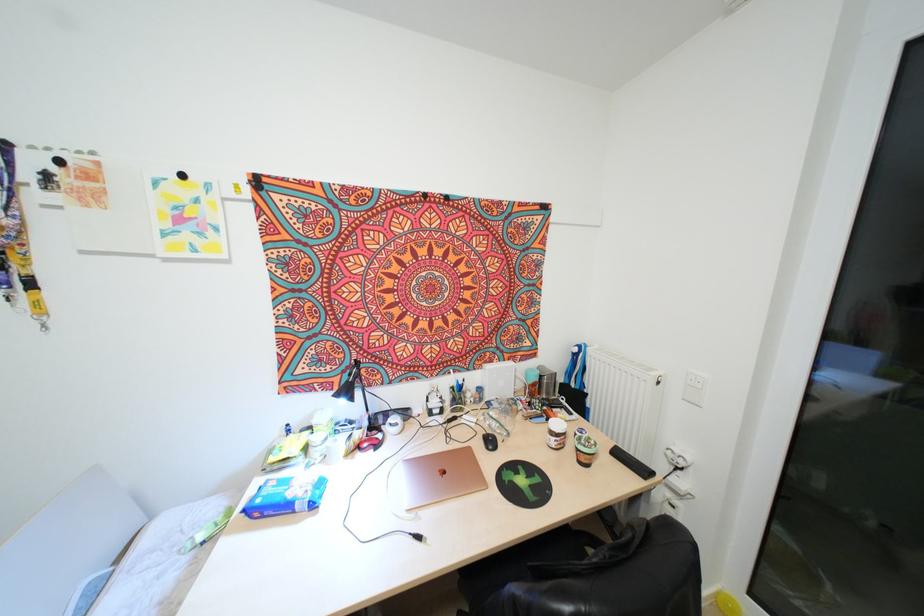
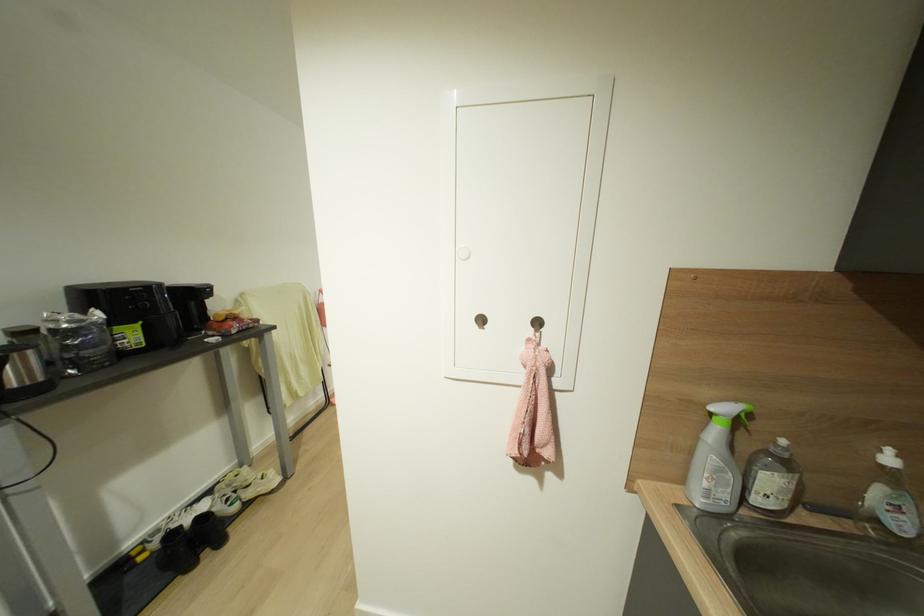
Question: I am providing you with two images of the same scene from different viewpoints. After the viewpoint changes to image2, which objects are now occluded?

Choices:
 (A) black shoe
 (B) black computer mouse
 (C) brown tape roll
 (D) silver electric kettle

Answer: (B)